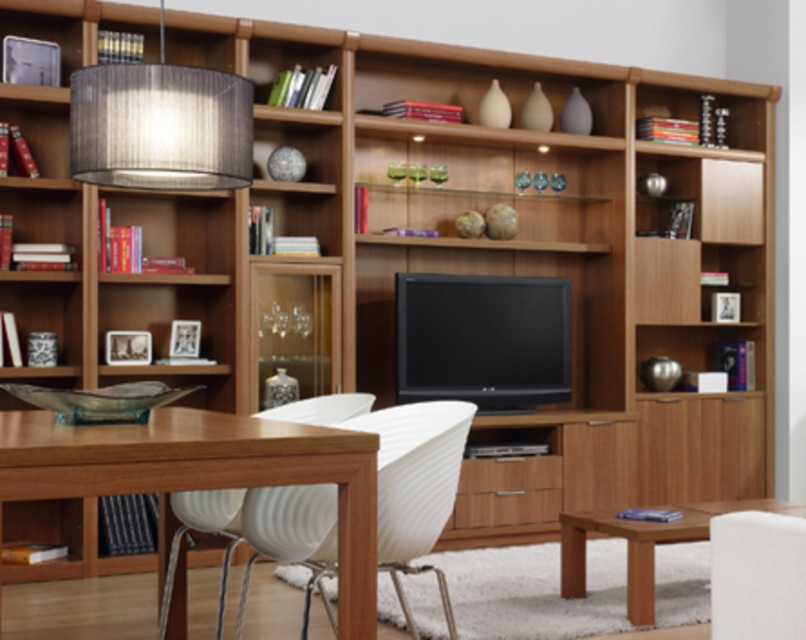
Question: Can you confirm if white ribbed plastic chair at center is positioned above white fabric armchair at lower right?

Choices:
 (A) yes
 (B) no

Answer: (B)

Question: Which is nearer to the white ribbed plastic chair at center?

Choices:
 (A) white fabric armchair at lower right
 (B) wooden table at lower left

Answer: (B)

Question: Does wooden table at lower left have a larger size compared to white ribbed plastic chair at center?

Choices:
 (A) yes
 (B) no

Answer: (A)

Question: Among these points, which one is nearest to the camera?

Choices:
 (A) [x=798, y=506]
 (B) [x=3, y=429]

Answer: (B)

Question: Is matte gray fabric lampshade at upper left above white fabric armchair at lower right?

Choices:
 (A) yes
 (B) no

Answer: (A)

Question: Which point is farther from the camera taking this photo?

Choices:
 (A) (755, 548)
 (B) (113, 476)
 (C) (406, 497)

Answer: (C)